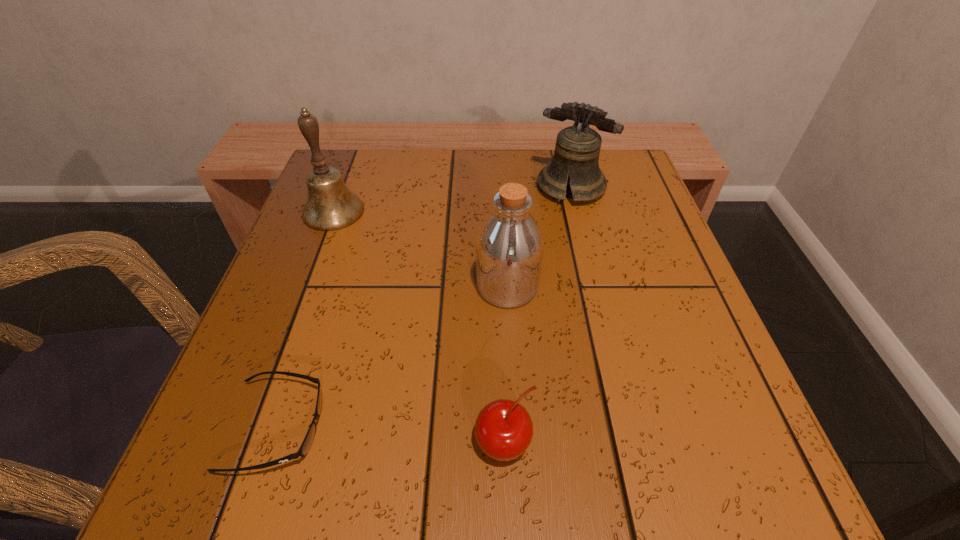
Find the location of a particular element. The image size is (960, 540). the taller bell is located at coordinates (330, 206).

Locate an element on the screen. bottle is located at coordinates (509, 250).

Locate an element on the screen. The width and height of the screenshot is (960, 540). the rightmost object is located at coordinates (577, 149).

The width and height of the screenshot is (960, 540). I want to click on the shorter bell, so click(577, 149).

This screenshot has width=960, height=540. I want to click on cherry, so click(503, 429).

Locate an element on the screen. The height and width of the screenshot is (540, 960). the shortest object is located at coordinates (306, 444).

Locate an element on the screen. The height and width of the screenshot is (540, 960). vacant space located 0.350m on the front of the left bell is located at coordinates (270, 382).

Image resolution: width=960 pixels, height=540 pixels. In order to click on free point located on the back of the third farthest object in this screenshot , I will do `click(501, 189)`.

Locate an element on the screen. vacant space situated 0.050m on the right of the right bell is located at coordinates (630, 188).

Where is `vacant area located on the back of the cherry`? This screenshot has height=540, width=960. vacant area located on the back of the cherry is located at coordinates (501, 380).